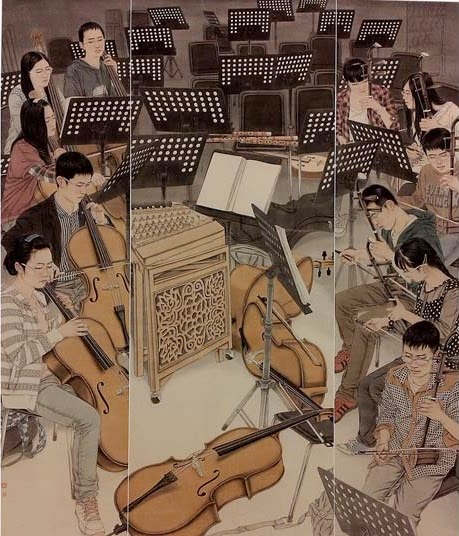
Locate an element on the screen. This screenshot has height=536, width=459. music stand is located at coordinates (92, 114), (382, 509).